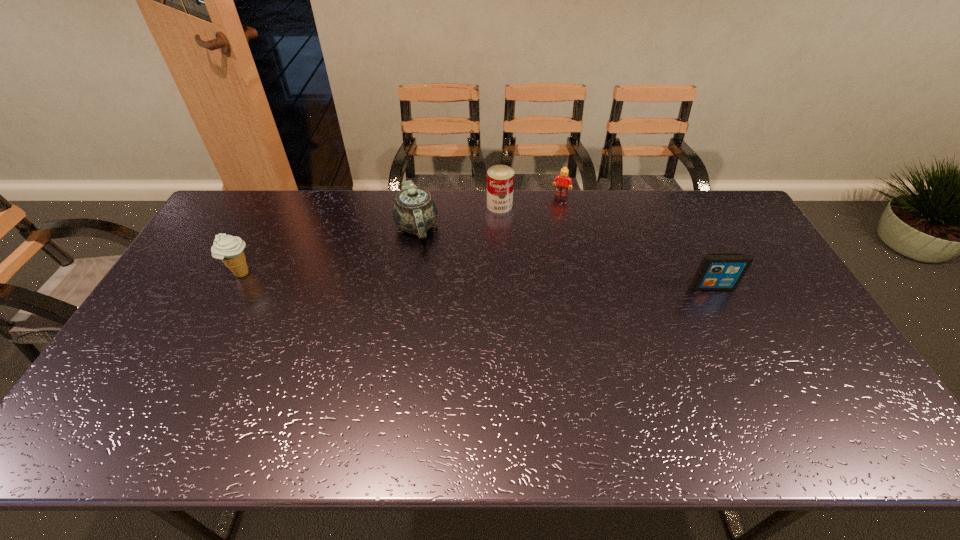
Find the location of `vacant space on the desktop that is between the leftmost object and the rightmost object and is positioned on the front label of the third object from left to right`. vacant space on the desktop that is between the leftmost object and the rightmost object and is positioned on the front label of the third object from left to right is located at coordinates (498, 281).

At what (x,y) coordinates should I click in order to perform the action: click on free space on the desktop that is between the leftmost object and the rightmost object and is positioned from the spout of the chinaware. Please return your answer as a coordinate pair (x, y). The height and width of the screenshot is (540, 960). Looking at the image, I should click on (405, 279).

Find the location of a particular element. free spot on the desktop that is between the icecream and the iPod and is positioned on the face of the Lego is located at coordinates (526, 282).